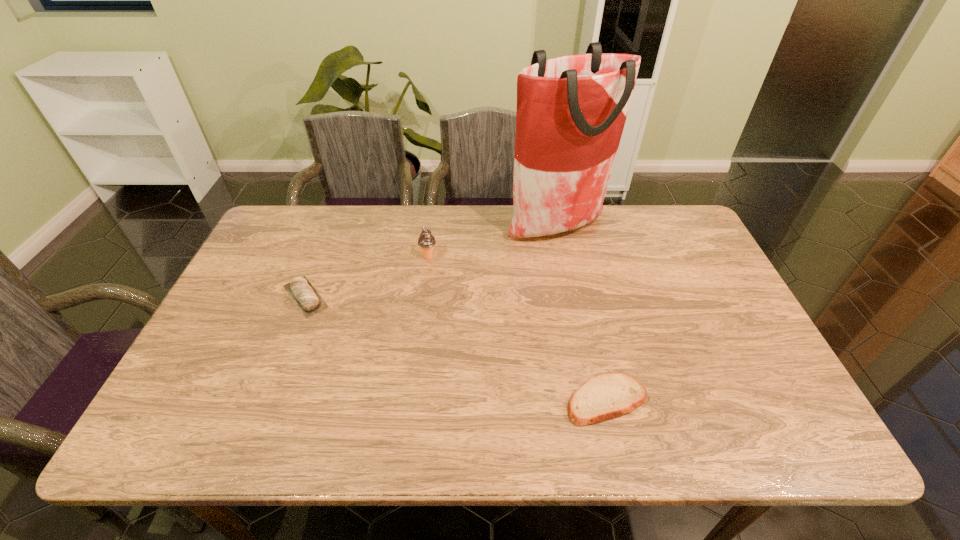
What are the coordinates of `free space at the near right corner` in the screenshot? It's located at (754, 416).

Find the location of a particular element. This screenshot has height=540, width=960. free area in between the third farthest object and the second object from left to right is located at coordinates (367, 276).

The image size is (960, 540). What are the coordinates of `vacant space in between the third farthest object and the third object from right to left` in the screenshot? It's located at (367, 276).

You are a GUI agent. You are given a task and a screenshot of the screen. Output one action in this format:
    pyautogui.click(x=<x>, y=<y>)
    Task: Click on the free space between the icecream and the nearer pita bread
    The image size is (960, 540).
    Given the screenshot: What is the action you would take?
    pyautogui.click(x=517, y=328)

This screenshot has height=540, width=960. What are the coordinates of `empty space that is in between the right pita bread and the grocery bag` in the screenshot? It's located at (582, 314).

Locate an element on the screen. Image resolution: width=960 pixels, height=540 pixels. free point between the second nearest object and the grocery bag is located at coordinates (432, 262).

What are the coordinates of `free point between the nearest object and the third shortest object` in the screenshot? It's located at (517, 328).

Image resolution: width=960 pixels, height=540 pixels. I want to click on free spot between the farther pita bread and the third object from right to left, so click(x=367, y=276).

At what (x,y) coordinates should I click in order to perform the action: click on free space between the shortest object and the tallest object. Please return your answer as a coordinate pair (x, y). Looking at the image, I should click on (582, 314).

Locate an element on the screen. This screenshot has width=960, height=540. unoccupied position between the shorter pita bread and the icecream is located at coordinates (517, 328).